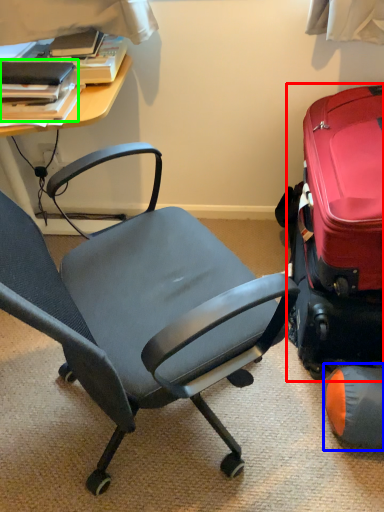
Question: Which object is the farthest from suitcase (highlighted by a red box)? Choose among these: bean bag chair (highlighted by a blue box) or book (highlighted by a green box).

Choices:
 (A) bean bag chair
 (B) book

Answer: (B)